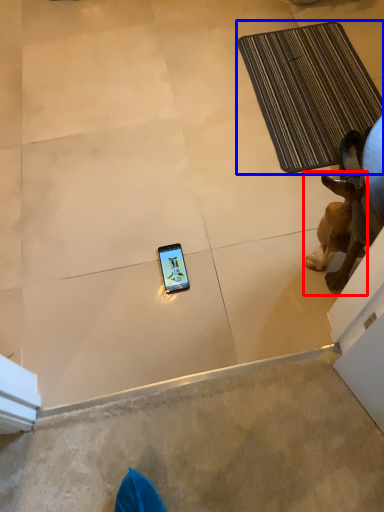
Question: Among these objects, which one is nearest to the camera, dog (highlighted by a red box) or bath mat (highlighted by a blue box)?

Choices:
 (A) dog
 (B) bath mat

Answer: (A)